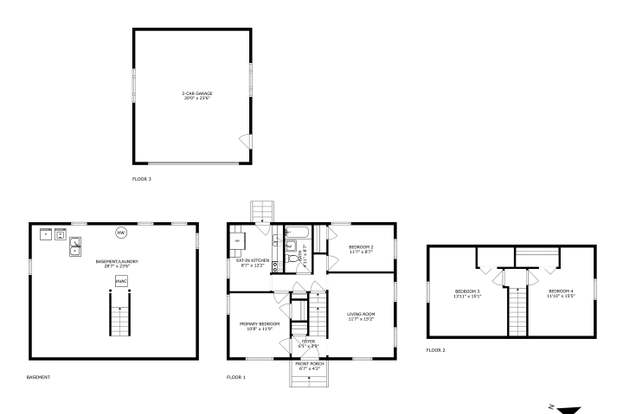
Locate an element on the screen. This screenshot has width=623, height=414. toilet is located at coordinates tap(292, 264).